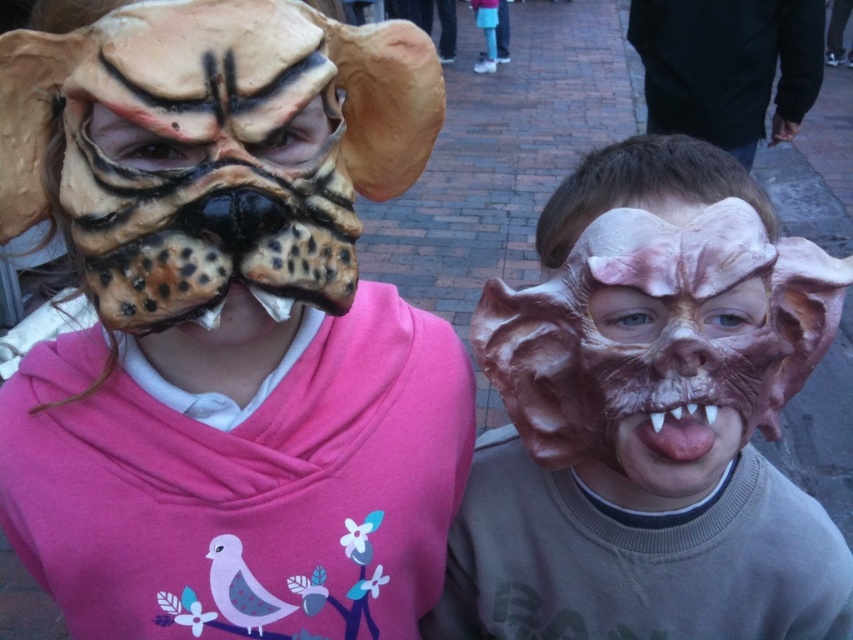
Does point (380, 477) come behind point (689, 465)?

Yes, point (380, 477) is behind point (689, 465).

Is point (270, 65) closer to viewer compared to point (599, 625)?

Yes, it is.

Between point (183, 140) and point (738, 605), which one is positioned in front?

Positioned in front is point (183, 140).

The width and height of the screenshot is (853, 640). Identify the location of matte pink sweatshirt at left. (225, 324).

Is matte pink mask at right behind sculpted rubber mask at center?

Yes, matte pink mask at right is behind sculpted rubber mask at center.

Can you confirm if matte pink mask at right is positioned above sculpted rubber mask at center?

Actually, matte pink mask at right is below sculpted rubber mask at center.

Image resolution: width=853 pixels, height=640 pixels. Find the location of `matte pink mask at right`. matte pink mask at right is located at coordinates (647, 412).

At what (x,y) coordinates should I click in order to perform the action: click on matte pink mask at right. Please return your answer as a coordinate pair (x, y). Looking at the image, I should click on (647, 412).

Does matte pink mask at right have a lesser height compared to pink glossy tongue at center?

Incorrect, matte pink mask at right's height does not fall short of pink glossy tongue at center's.

Is point (630, 538) closer to viewer compared to point (665, 448)?

No, it is behind (665, 448).

Where is `matte pink mask at right`? This screenshot has height=640, width=853. matte pink mask at right is located at coordinates (647, 412).